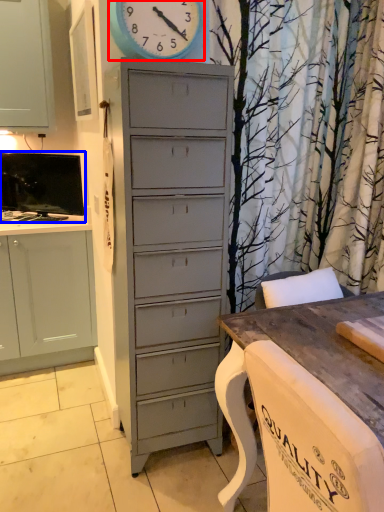
Question: Among these objects, which one is farthest to the camera, clock (highlighted by a red box) or television (highlighted by a blue box)?

Choices:
 (A) clock
 (B) television

Answer: (B)